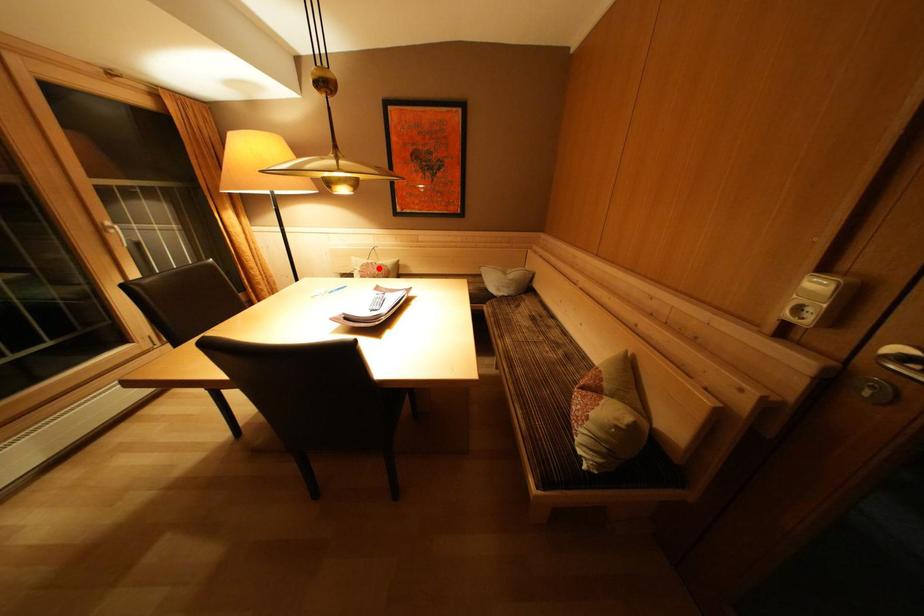
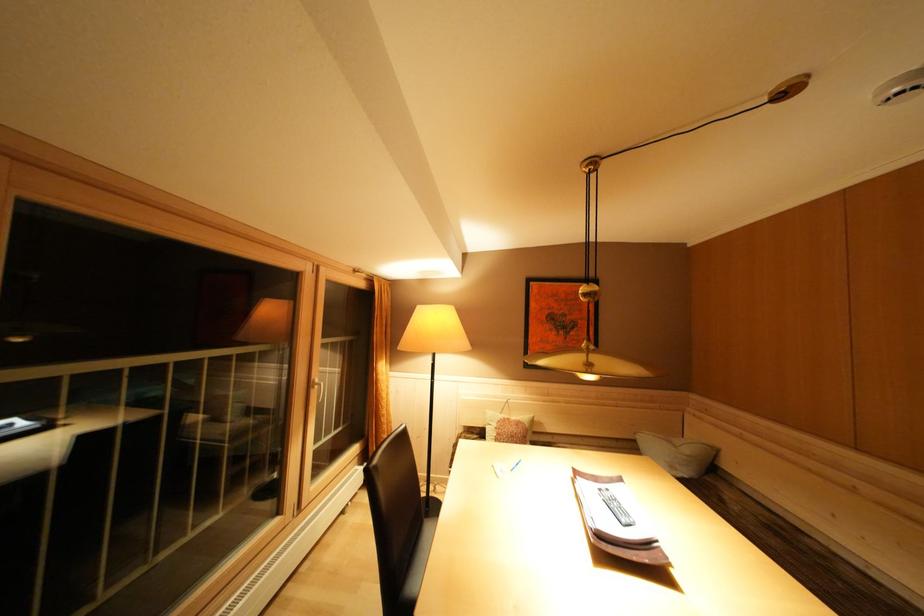
The point at the highlighted location is marked in the first image. Where is the corresponding point in the second image?

(515, 424)